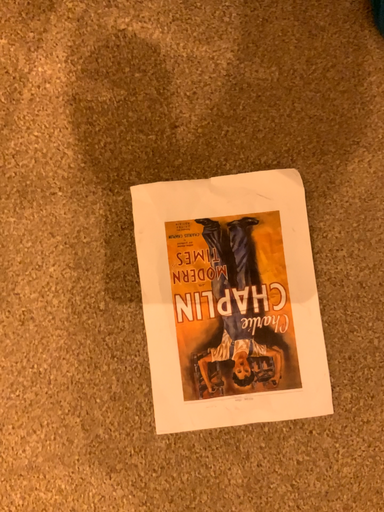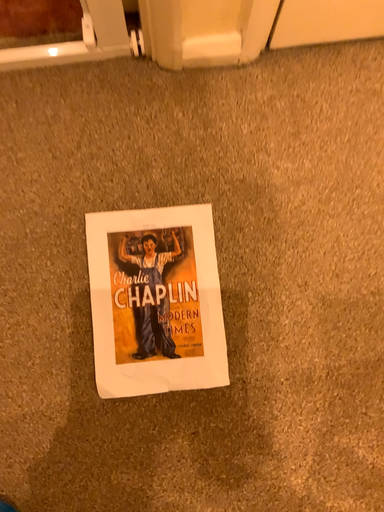
Question: How did the camera likely rotate when shooting the video?

Choices:
 (A) rotated downward
 (B) rotated upward

Answer: (B)